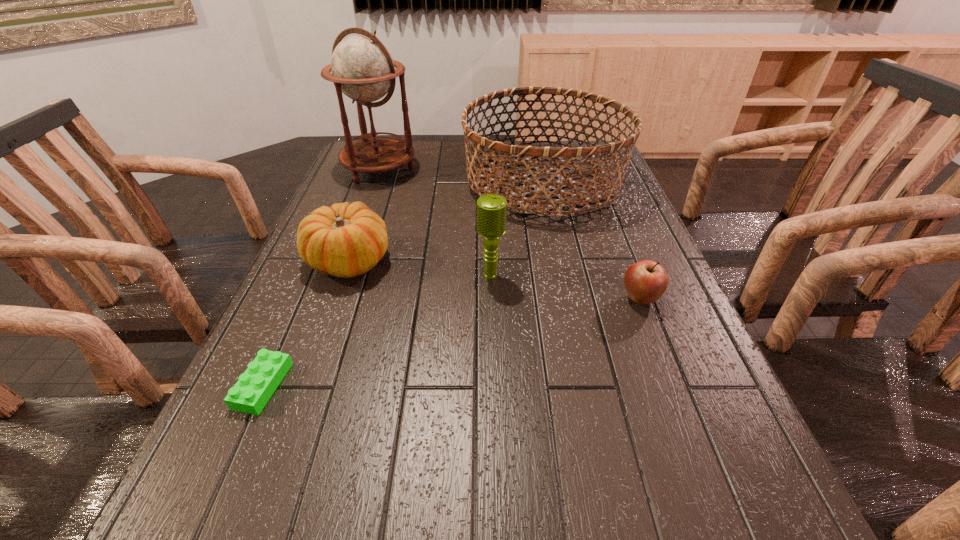
I want to click on free area in between the basket and the gourd, so point(445,221).

Find the location of a particular element. This screenshot has width=960, height=540. unoccupied area between the gourd and the apple is located at coordinates (494, 280).

Identify the location of vacant space in between the microphone and the basket. The height and width of the screenshot is (540, 960). (516, 228).

Locate an element on the screen. The height and width of the screenshot is (540, 960). vacant area that lies between the microphone and the basket is located at coordinates (516, 228).

I want to click on vacant region between the basket and the gourd, so click(x=445, y=221).

I want to click on object identified as the fifth closest to the shortest object, so click(x=646, y=281).

Where is `object that ranks as the closest to the globe`? object that ranks as the closest to the globe is located at coordinates (593, 151).

This screenshot has height=540, width=960. I want to click on vacant position in the image that satisfies the following two spatial constraints: 1. on the surface of the globe; 2. on the left side of the microphone, so click(x=340, y=276).

Where is `free point that satisfies the following two spatial constraints: 1. on the surface of the tallest object; 2. on the right side of the gourd`? free point that satisfies the following two spatial constraints: 1. on the surface of the tallest object; 2. on the right side of the gourd is located at coordinates (346, 261).

Where is `vacant space that satisfies the following two spatial constraints: 1. on the surface of the globe; 2. on the right side of the microphone`? vacant space that satisfies the following two spatial constraints: 1. on the surface of the globe; 2. on the right side of the microphone is located at coordinates (340, 276).